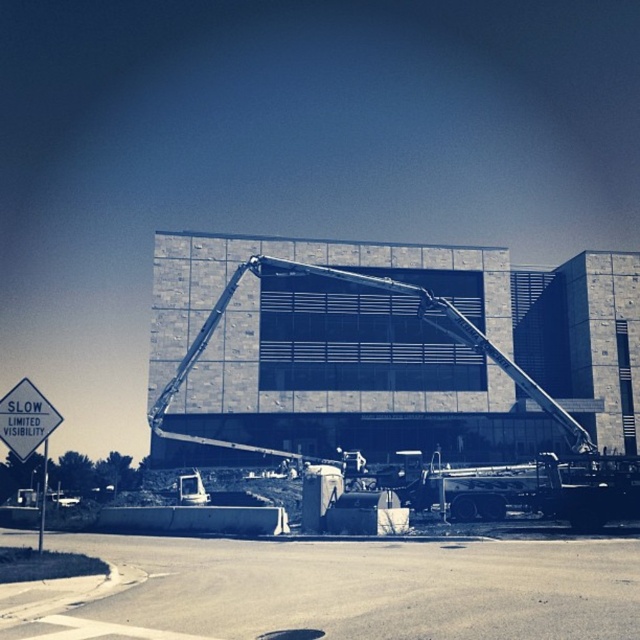
Question: Where is metallic gray crane at center located in relation to white plastic sign at upper left in the image?

Choices:
 (A) right
 (B) left

Answer: (A)

Question: Which point is farther to the camera?

Choices:
 (A) (8, 401)
 (B) (195, 337)

Answer: (B)

Question: Among these objects, which one is farthest from the camera?

Choices:
 (A) white plastic sign at upper left
 (B) metallic gray crane at center

Answer: (B)

Question: Which of the following is the farthest from the observer?

Choices:
 (A) (554, 406)
 (B) (38, 392)

Answer: (A)

Question: Can you confirm if metallic gray crane at center is positioned to the left of white plastic sign at upper left?

Choices:
 (A) no
 (B) yes

Answer: (A)

Question: Does metallic gray crane at center have a greater width compared to white plastic sign at upper left?

Choices:
 (A) no
 (B) yes

Answer: (B)